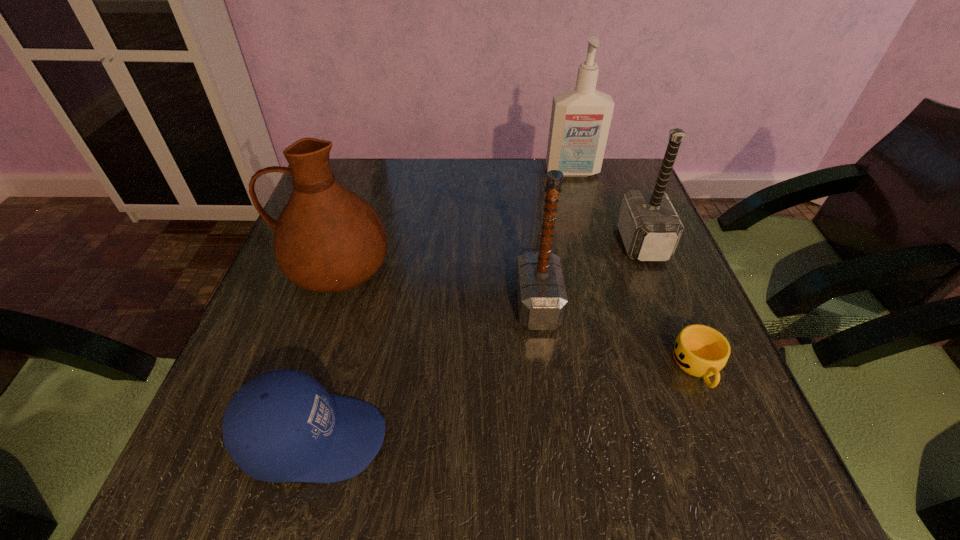
Locate an element on the screen. free space between the nearer hammer and the shortest object is located at coordinates (617, 335).

This screenshot has height=540, width=960. What are the coordinates of `object that stands as the third closest to the cleansing agent` in the screenshot? It's located at pos(327,239).

Locate which object is the fourth closest to the pitcher. Please provide its 2D coordinates. Your answer should be formatted as a tuple, i.e. [(x, y)], where the tuple contains the x and y coordinates of a point satisfying the conditions above.

[(650, 228)]

The height and width of the screenshot is (540, 960). I want to click on vacant space that satisfies the following two spatial constraints: 1. for striking with the head of the right hammer; 2. on the right side of the cup, so click(691, 367).

The height and width of the screenshot is (540, 960). I want to click on vacant space that satisfies the following two spatial constraints: 1. on the back side of the shortest object; 2. on the striking surface of the third object from left to right, so click(x=672, y=305).

I want to click on free space that satisfies the following two spatial constraints: 1. for striking with the head of the farther hammer; 2. on the back side of the second nearest object, so click(691, 367).

Where is `free space that satisfies the following two spatial constraints: 1. on the front label of the fifth farthest object; 2. on the right side of the farthest object`? free space that satisfies the following two spatial constraints: 1. on the front label of the fifth farthest object; 2. on the right side of the farthest object is located at coordinates (625, 367).

Locate an element on the screen. Image resolution: width=960 pixels, height=540 pixels. free space that satisfies the following two spatial constraints: 1. on the back side of the shortest object; 2. for striking with the head of the right hammer is located at coordinates (647, 243).

Where is `free space that satisfies the following two spatial constraints: 1. on the front label of the farthest object; 2. on the side of the pitcher with the handle`? The width and height of the screenshot is (960, 540). free space that satisfies the following two spatial constraints: 1. on the front label of the farthest object; 2. on the side of the pitcher with the handle is located at coordinates (599, 269).

Locate an element on the screen. vacant space that satisfies the following two spatial constraints: 1. on the striking surface of the left hammer; 2. on the back side of the second nearest object is located at coordinates (545, 367).